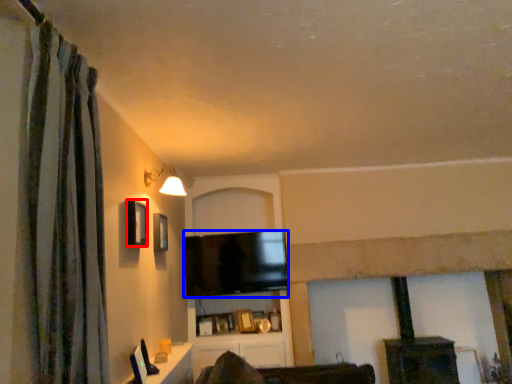
Question: Among these objects, which one is nearest to the camera, window (highlighted by a red box) or television (highlighted by a blue box)?

Choices:
 (A) window
 (B) television

Answer: (A)